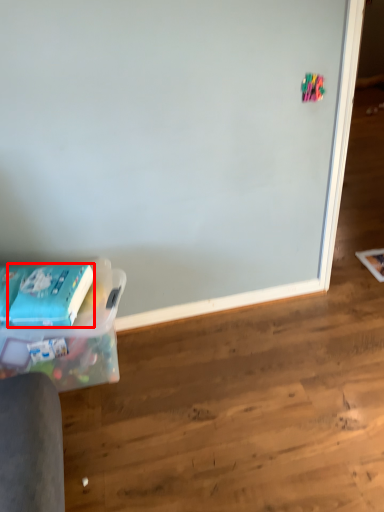
Question: From the image's perspective, where is paperback book (annotated by the red box) located in relation to box in the image?

Choices:
 (A) below
 (B) above

Answer: (B)